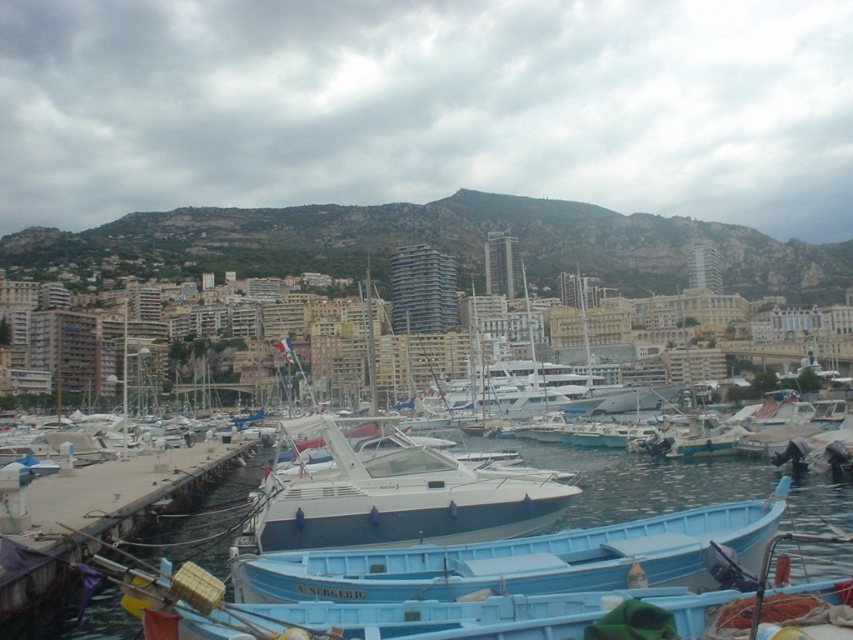
You are a photographer planning to capture the entire scene of the marina. Given that your camera can only focus on objects within a 100 square meter area, and the white glossy boat at center takes up 40 square meters of your frame, will the blue water at center also fit within the focus area?

The blue water at center is larger in size than the white glossy boat at center. Since the boat already occupies 40 square meters, the water requires more space, so it might not fully fit within the 100 square meter focus area.

You are standing on the concrete dock at lower left and want to board the light blue plastic boat at lower center. Can you walk directly to the boat without stepping into the water?

The light blue plastic boat at lower center might be wider than concrete dock at lower left, so there is a possibility that the distance between them is manageable. However, without exact measurements, it is uncertain if you can walk directly to the boat without stepping into the water.